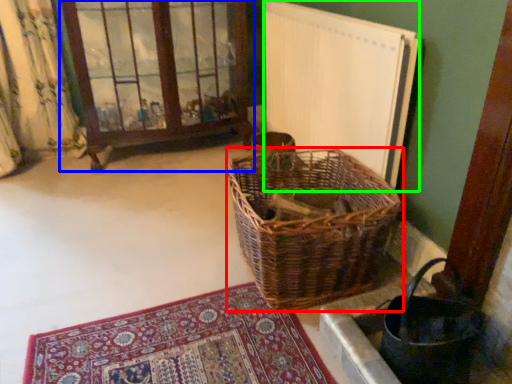
Question: Which object is the farthest from picnic basket (highlighted by a red box)? Choose among these: window frame (highlighted by a blue box) or radiator (highlighted by a green box).

Choices:
 (A) window frame
 (B) radiator

Answer: (A)